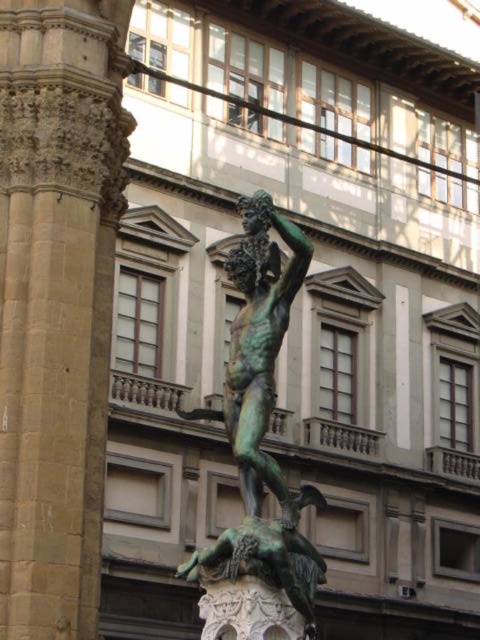
You are an art conservator examining the bronze statue. You notice two points on the statue, one at coordinate point (55, 230) and another at point (253, 540). Which point is closer to you?

Point (55, 230) is further to the viewer than point (253, 540), so the point closer to you is point (253, 540).

You are an art conservator examining the statue and its pedestal. You notice the smooth stone pillar at center and the green patina bronze at center. Which object is positioned higher in the scene?

The smooth stone pillar at center is located above the green patina bronze at center, so it is positioned higher in the scene.

You are an art conservator assessing the statue and its pedestal. Given that the smooth stone pillar at center supports the green patina bronze at center, does the pillar have sufficient height to adequately support the bronze?

The smooth stone pillar at center is taller than green patina bronze at center, so yes, the pillar has sufficient height to adequately support the bronze.